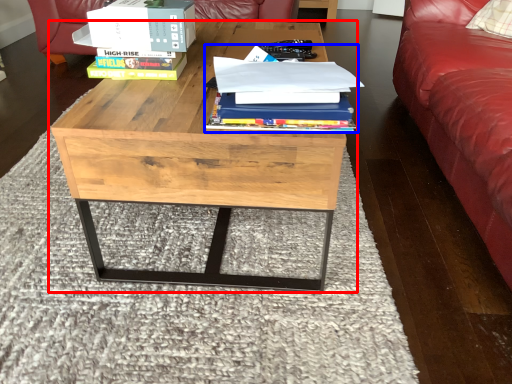
Question: Which object is closer to the camera taking this photo, coffee table (highlighted by a red box) or book (highlighted by a blue box)?

Choices:
 (A) coffee table
 (B) book

Answer: (B)